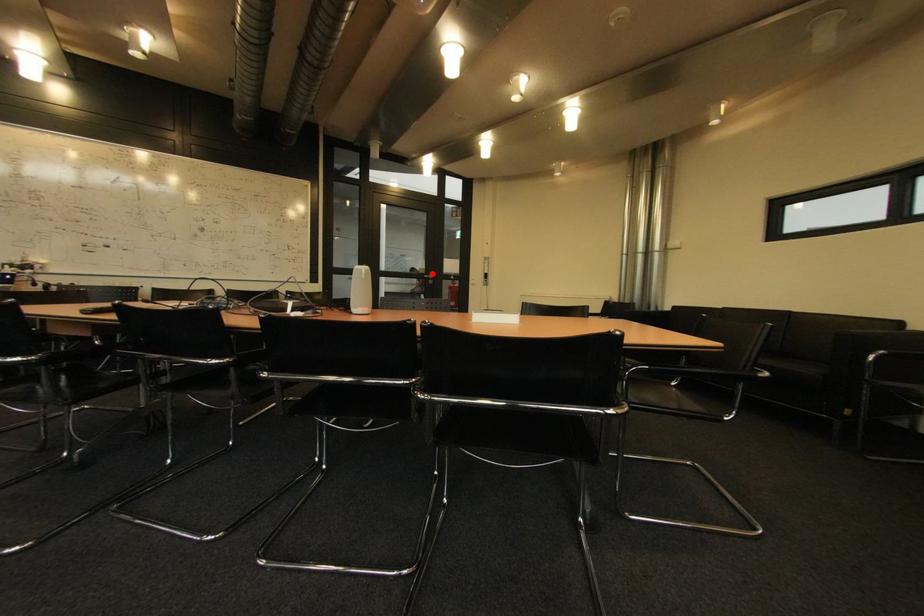
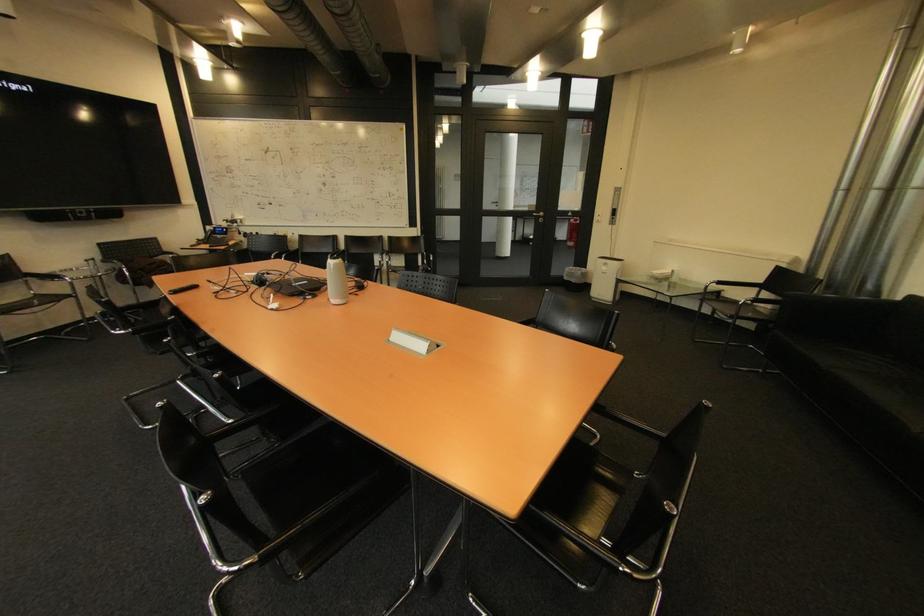
Question: I am providing you with two images of the same scene from different viewpoints. In image1, a red point is highlighted. Considering the same 3D point in image2, which of the following is correct?

Choices:
 (A) It is closer
 (B) It is farther

Answer: (A)